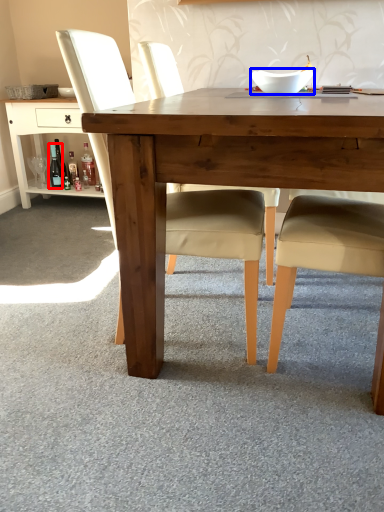
Question: Which object appears closest to the camera in this image, bottle (highlighted by a red box) or bowl (highlighted by a blue box)?

Choices:
 (A) bottle
 (B) bowl

Answer: (B)